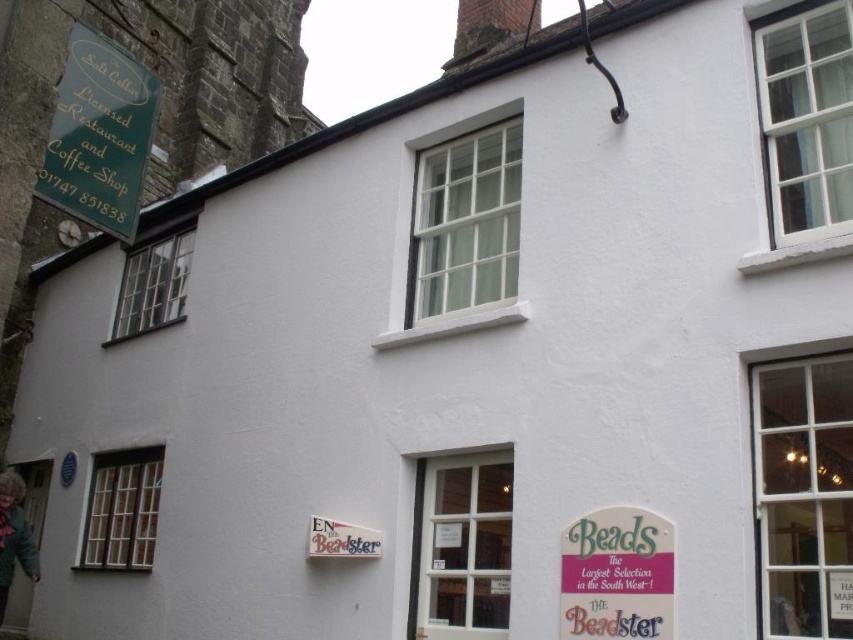
You are a delivery person trying to attach a new sign to the building. The new sign is 1.2 meters wide. The existing signs are the green painted wood signboard at upper left and the green paper sign at center. Which existing sign has enough space next to it to accommodate the new sign if placed horizontally?

The green paper sign at center has a greater width than the green painted wood signboard at upper left, so there might be more space next to it to accommodate the new sign.

You are a visitor approaching the building and want to read both the green painted wood signboard at upper left and the green paper sign at center. Which sign should you look at first to the left?

The green painted wood signboard at upper left is to the left of the green paper sign at center, so you should look at the green painted wood signboard at upper left first as it is positioned more to the left.